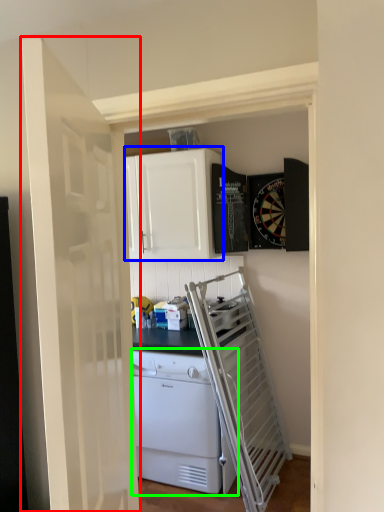
Question: Estimate the real-world distances between objects in this image. Which object is closer to door (highlighted by a red box), cabinetry (highlighted by a blue box) or home appliance (highlighted by a green box)?

Choices:
 (A) cabinetry
 (B) home appliance

Answer: (B)